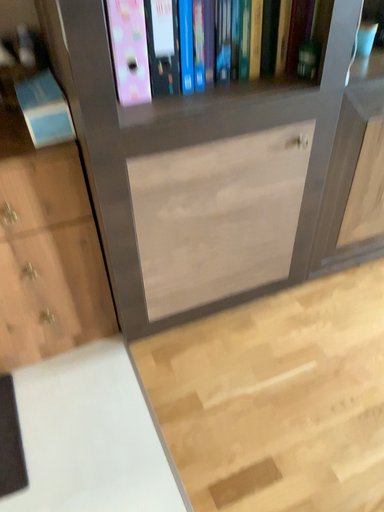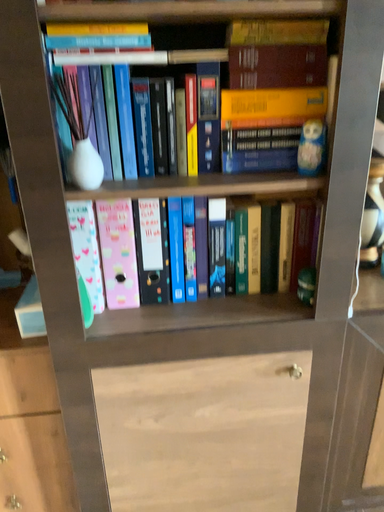
Question: How did the camera likely rotate when shooting the video?

Choices:
 (A) rotated left
 (B) rotated right

Answer: (A)